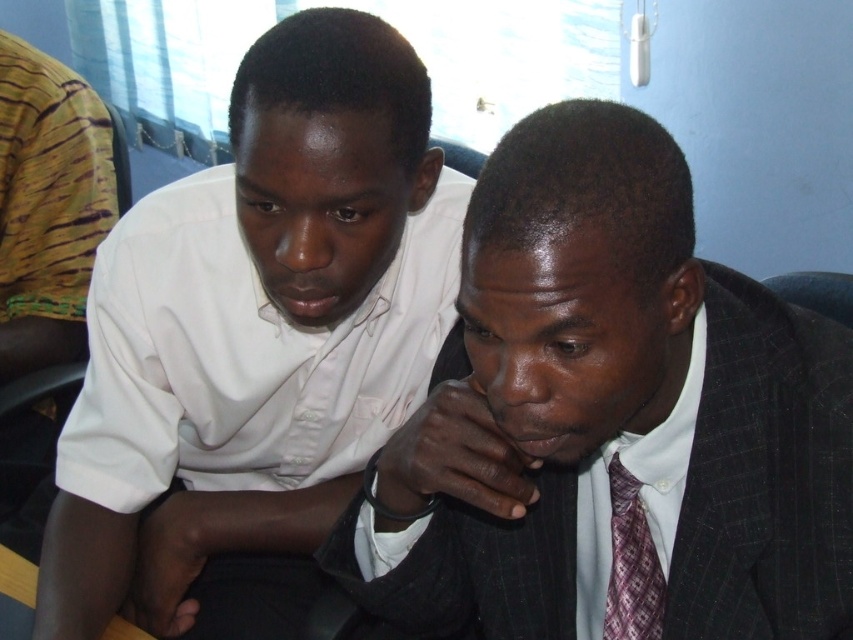
Is white shirt at left shorter than plaid silk tie at center?

Incorrect, white shirt at left's height does not fall short of plaid silk tie at center's.

Is white shirt at left above plaid silk tie at center?

Yes.

Find the location of a particular element. This screenshot has width=853, height=640. white shirt at left is located at coordinates (256, 326).

Locate an element on the screen. This screenshot has width=853, height=640. white shirt at left is located at coordinates (256, 326).

Can you confirm if dark gray suit at center is positioned above white shirt at left?

No.

Who is more distant from viewer, (846,401) or (233,326)?

The point (233,326) is behind.

At what (x,y) coordinates should I click in order to perform the action: click on dark gray suit at center. Please return your answer as a coordinate pair (x, y). The width and height of the screenshot is (853, 640). Looking at the image, I should click on (612, 413).

Is point (767, 630) behind point (637, 625)?

No, it is not.

Between point (799, 531) and point (618, 536), which one is positioned in front?

Point (799, 531) is in front.

Identify the location of dark gray suit at center. (612, 413).